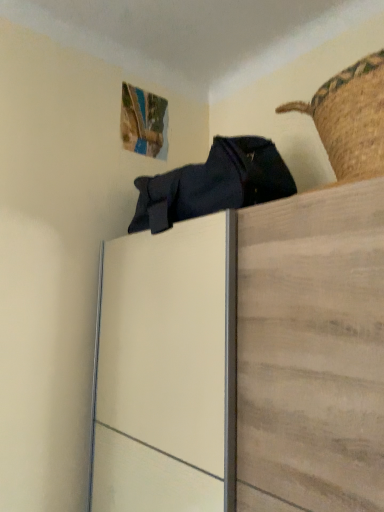
What do you see at coordinates (245, 358) in the screenshot? This screenshot has height=512, width=384. I see `white matte wardrobe at upper right` at bounding box center [245, 358].

Locate an element on the screen. This screenshot has height=512, width=384. white matte wardrobe at upper right is located at coordinates (245, 358).

The image size is (384, 512). I want to click on white matte wardrobe at upper right, so click(x=245, y=358).